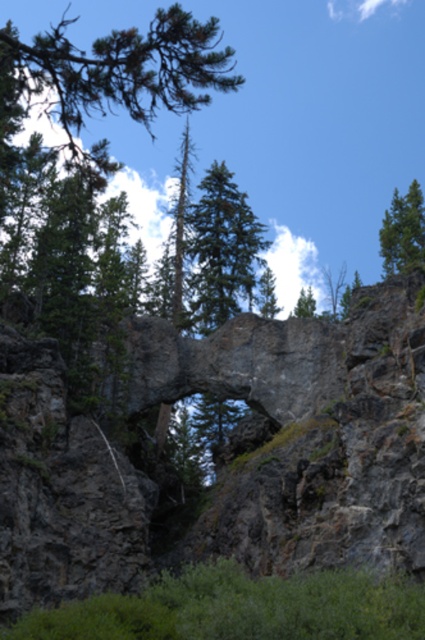
What do you see at coordinates (402, 230) in the screenshot?
I see `green matte tree at upper right` at bounding box center [402, 230].

Measure the distance between green matte tree at upper right and camera.

93.28 meters

This screenshot has height=640, width=425. Identify the location of green matte tree at upper right. (402, 230).

This screenshot has height=640, width=425. What are the coordinates of `green matte tree at upper right` in the screenshot? It's located at pyautogui.click(x=402, y=230).

Between green textured tree at center and green matte tree at upper right, which one is positioned lower?

green textured tree at center

Is point (215, 172) positioned behind point (396, 221)?

Yes, point (215, 172) is behind point (396, 221).

You are a GUI agent. You are given a task and a screenshot of the screen. Output one action in this format:
    pyautogui.click(x=<x>, y=<y>)
    Task: Click on the green textured tree at center
    
    Given the screenshot: What is the action you would take?
    pyautogui.click(x=221, y=250)

Consider the image. Which is below, green textured tree at center or green leafy tree at upper center?

Positioned lower is green leafy tree at upper center.

Can you confirm if green textured tree at center is wider than green leafy tree at upper center?

Correct, the width of green textured tree at center exceeds that of green leafy tree at upper center.

Between point (249, 304) and point (309, 298), which one is positioned behind?

The point (309, 298) is behind.

Find the location of `green textured tree at center`. green textured tree at center is located at coordinates (221, 250).